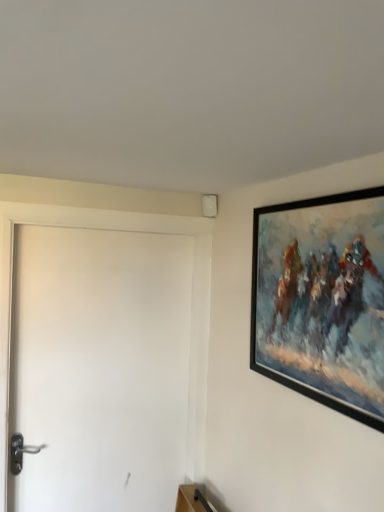
Describe the element at coordinates (322, 300) in the screenshot. I see `black matte picture frame at upper right` at that location.

You are a GUI agent. You are given a task and a screenshot of the screen. Output one action in this format:
    pyautogui.click(x=<x>, y=<y>)
    Task: Click on the black matte picture frame at upper right
    
    Given the screenshot: What is the action you would take?
    pyautogui.click(x=322, y=300)

Describe the element at coordinates (100, 368) in the screenshot. This screenshot has width=384, height=512. I see `white matte door at left` at that location.

Measure the distance between point (19, 378) and camera.

Point (19, 378) is 1.67 meters away from camera.

Locate an element on the screen. This screenshot has height=512, width=384. white matte door at left is located at coordinates click(x=100, y=368).

You are a GUI agent. You are given a task and a screenshot of the screen. Output one action in this format:
    pyautogui.click(x=<x>, y=<y>)
    Task: Click on the black matte picture frame at upper right
    The height and width of the screenshot is (512, 384).
    Given the screenshot: What is the action you would take?
    pyautogui.click(x=322, y=300)

Considering the positions of objects black matte picture frame at upper right and white matte door at left in the image provided, who is more to the right, black matte picture frame at upper right or white matte door at left?

Positioned to the right is black matte picture frame at upper right.

Considering the relative positions of black matte picture frame at upper right and white matte door at left in the image provided, is black matte picture frame at upper right behind white matte door at left?

No, the depth of black matte picture frame at upper right is less than that of white matte door at left.

Which is behind, point (267, 321) or point (185, 442)?

Positioned behind is point (185, 442).

From the image's perspective, which is below, black matte picture frame at upper right or white matte door at left?

white matte door at left.

From a real-world perspective, is black matte picture frame at upper right located higher than white matte door at left?

Yes.

Which of these two, black matte picture frame at upper right or white matte door at left, is wider?

white matte door at left.

In terms of height, does black matte picture frame at upper right look taller or shorter compared to white matte door at left?

black matte picture frame at upper right is shorter than white matte door at left.

Looking at this image, considering the relative sizes of black matte picture frame at upper right and white matte door at left in the image provided, is black matte picture frame at upper right smaller than white matte door at left?

Correct, black matte picture frame at upper right occupies less space than white matte door at left.

Is black matte picture frame at upper right inside or outside of white matte door at left?

black matte picture frame at upper right is outside white matte door at left.

Is black matte picture frame at upper right far away from white matte door at left?

No, black matte picture frame at upper right is in close proximity to white matte door at left.

Is black matte picture frame at upper right oriented away from white matte door at left?

No, black matte picture frame at upper right's orientation is not away from white matte door at left.

Measure the distance from black matte picture frame at upper right to white matte door at left.

A distance of 30.48 inches exists between black matte picture frame at upper right and white matte door at left.

Where is `picture frame on the right of white matte door at left`? picture frame on the right of white matte door at left is located at coordinates (322, 300).

Visually, is white matte door at left positioned to the left or to the right of black matte picture frame at upper right?

white matte door at left is to the left of black matte picture frame at upper right.

Considering the positions of objects white matte door at left and black matte picture frame at upper right in the image provided, who is behind, white matte door at left or black matte picture frame at upper right?

white matte door at left is more distant.

Which is in front, point (127, 436) or point (372, 327)?

The point (372, 327) is more forward.

From the image's perspective, is white matte door at left on black matte picture frame at upper right?

Incorrect, from the image's perspective, white matte door at left is lower than black matte picture frame at upper right.

From a real-world perspective, is white matte door at left positioned above or below black matte picture frame at upper right?

Clearly, from a real-world perspective, white matte door at left is below black matte picture frame at upper right.

Considering the sizes of objects white matte door at left and black matte picture frame at upper right in the image provided, who is thinner, white matte door at left or black matte picture frame at upper right?

With smaller width is black matte picture frame at upper right.

Can you confirm if white matte door at left is taller than black matte picture frame at upper right?

Yes, white matte door at left is taller than black matte picture frame at upper right.

Is white matte door at left bigger than black matte picture frame at upper right?

Correct, white matte door at left is larger in size than black matte picture frame at upper right.

Can we say white matte door at left lies outside black matte picture frame at upper right?

white matte door at left lies outside black matte picture frame at upper right's area.

Is white matte door at left not near black matte picture frame at upper right?

white matte door at left is near black matte picture frame at upper right, not far away.

Is black matte picture frame at upper right at the back of white matte door at left?

No, white matte door at left is not facing the opposite direction of black matte picture frame at upper right.

Locate an element on the screen. The image size is (384, 512). picture frame located above the white matte door at left (from the image's perspective) is located at coordinates (322, 300).

I want to click on picture frame that appears on the right of white matte door at left, so click(x=322, y=300).

Where is `door that appears below the black matte picture frame at upper right (from a real-world perspective)`? door that appears below the black matte picture frame at upper right (from a real-world perspective) is located at coordinates (100, 368).